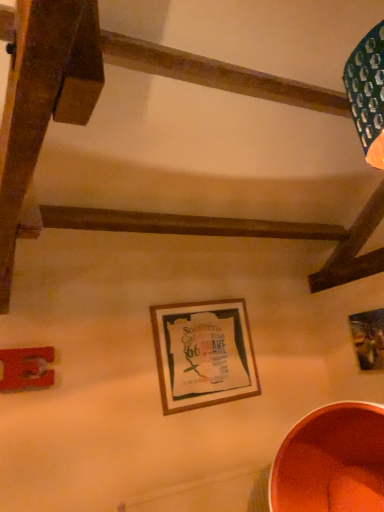
Image resolution: width=384 pixels, height=512 pixels. What do you see at coordinates (368, 339) in the screenshot? I see `wooden picture frame at upper right, placed as the 1th picture frame when sorted from right to left` at bounding box center [368, 339].

Identify the location of wooden picture frame at center, which is the 2th picture frame from left to right. (203, 354).

Where is `metallic silver picture frame at lower left, which ranks as the 1th picture frame in left-to-right order`? metallic silver picture frame at lower left, which ranks as the 1th picture frame in left-to-right order is located at coordinates (26, 369).

This screenshot has width=384, height=512. In order to click on picture frame that is the 2nd one when counting forward from the wooden picture frame at upper right, which ranks as the third picture frame in left-to-right order in this screenshot , I will do `click(26, 369)`.

Is wooden picture frame at upper right, which ranks as the third picture frame in left-to-right order, positioned far away from metallic silver picture frame at lower left, which ranks as the 1th picture frame in left-to-right order?

Yes, wooden picture frame at upper right, which ranks as the third picture frame in left-to-right order, and metallic silver picture frame at lower left, which ranks as the 1th picture frame in left-to-right order, are located far from each other.

Which of these two, wooden picture frame at upper right, placed as the 1th picture frame when sorted from right to left, or metallic silver picture frame at lower left, which ranks as the 1th picture frame in left-to-right order, is wider?

wooden picture frame at upper right, placed as the 1th picture frame when sorted from right to left, is wider.

From the image's perspective, who appears lower, wooden picture frame at center, which is the 2th picture frame from left to right, or metallic silver picture frame at lower left, which ranks as the 1th picture frame in left-to-right order?

wooden picture frame at center, which is the 2th picture frame from left to right, appears lower in the image.

Is wooden picture frame at center, which is the 2th picture frame from left to right, inside or outside of metallic silver picture frame at lower left, which is the third picture frame in right-to-left order?

wooden picture frame at center, which is the 2th picture frame from left to right, is located beyond the bounds of metallic silver picture frame at lower left, which is the third picture frame in right-to-left order.

This screenshot has height=512, width=384. In order to click on picture frame that is below the metallic silver picture frame at lower left, which ranks as the 1th picture frame in left-to-right order (from the image's perspective) in this screenshot , I will do `click(203, 354)`.

From the picture: Are wooden picture frame at center, which appears as the second picture frame when viewed from the right, and metallic silver picture frame at lower left, which is the third picture frame in right-to-left order, beside each other?

No, wooden picture frame at center, which appears as the second picture frame when viewed from the right, is not with metallic silver picture frame at lower left, which is the third picture frame in right-to-left order.

Looking at their sizes, would you say metallic silver picture frame at lower left, which ranks as the 1th picture frame in left-to-right order, is wider or thinner than metallic copper basin at lower right?

metallic silver picture frame at lower left, which ranks as the 1th picture frame in left-to-right order, is thinner than metallic copper basin at lower right.

Is metallic silver picture frame at lower left, which ranks as the 1th picture frame in left-to-right order, in contact with metallic copper basin at lower right?

No, metallic silver picture frame at lower left, which ranks as the 1th picture frame in left-to-right order, is not in contact with metallic copper basin at lower right.

Is metallic copper basin at lower right inside metallic silver picture frame at lower left, which is the third picture frame in right-to-left order?

No, metallic copper basin at lower right is not a part of metallic silver picture frame at lower left, which is the third picture frame in right-to-left order.

From the picture: From the image's perspective, who appears lower, metallic copper basin at lower right or wooden picture frame at center, which appears as the second picture frame when viewed from the right?

metallic copper basin at lower right is shown below in the image.

Which is behind, metallic copper basin at lower right or wooden picture frame at center, which appears as the second picture frame when viewed from the right?

wooden picture frame at center, which appears as the second picture frame when viewed from the right, is behind.

Is metallic copper basin at lower right not close to wooden picture frame at center, which appears as the second picture frame when viewed from the right?

No, there isn't a large distance between metallic copper basin at lower right and wooden picture frame at center, which appears as the second picture frame when viewed from the right.

Is wooden picture frame at center, which appears as the second picture frame when viewed from the right, located within metallic copper basin at lower right?

No, wooden picture frame at center, which appears as the second picture frame when viewed from the right, is located outside of metallic copper basin at lower right.

Is metallic silver picture frame at lower left, which ranks as the 1th picture frame in left-to-right order, closer to the viewer compared to wooden picture frame at center, which appears as the second picture frame when viewed from the right?

Yes, the depth of metallic silver picture frame at lower left, which ranks as the 1th picture frame in left-to-right order, is less than that of wooden picture frame at center, which appears as the second picture frame when viewed from the right.

How many degrees apart are the facing directions of metallic silver picture frame at lower left, which is the third picture frame in right-to-left order, and wooden picture frame at center, which appears as the second picture frame when viewed from the right?

There is a 1.56-degree angle between the facing directions of metallic silver picture frame at lower left, which is the third picture frame in right-to-left order, and wooden picture frame at center, which appears as the second picture frame when viewed from the right.

In the scene shown: From the image's perspective, between metallic silver picture frame at lower left, which ranks as the 1th picture frame in left-to-right order, and wooden picture frame at center, which is the 2th picture frame from left to right, which one is located above?

metallic silver picture frame at lower left, which ranks as the 1th picture frame in left-to-right order, is shown above in the image.

Is metallic silver picture frame at lower left, which ranks as the 1th picture frame in left-to-right order, facing away from wooden picture frame at center, which appears as the second picture frame when viewed from the right?

No, metallic silver picture frame at lower left, which ranks as the 1th picture frame in left-to-right order,'s orientation is not away from wooden picture frame at center, which appears as the second picture frame when viewed from the right.

Is the surface of metallic silver picture frame at lower left, which ranks as the 1th picture frame in left-to-right order, in direct contact with wooden picture frame at upper right, which ranks as the third picture frame in left-to-right order?

No, metallic silver picture frame at lower left, which ranks as the 1th picture frame in left-to-right order, is not next to wooden picture frame at upper right, which ranks as the third picture frame in left-to-right order.

Can we say metallic silver picture frame at lower left, which is the third picture frame in right-to-left order, lies outside wooden picture frame at upper right, which ranks as the third picture frame in left-to-right order?

Yes.

How different are the orientations of metallic silver picture frame at lower left, which ranks as the 1th picture frame in left-to-right order, and wooden picture frame at upper right, placed as the 1th picture frame when sorted from right to left, in degrees?

88.4 degrees.

Does metallic silver picture frame at lower left, which is the third picture frame in right-to-left order, come in front of wooden picture frame at upper right, which ranks as the third picture frame in left-to-right order?

Yes, the depth of metallic silver picture frame at lower left, which is the third picture frame in right-to-left order, is less than that of wooden picture frame at upper right, which ranks as the third picture frame in left-to-right order.

From a real-world perspective, which is physically above, metallic copper basin at lower right or wooden picture frame at upper right, placed as the 1th picture frame when sorted from right to left?

wooden picture frame at upper right, placed as the 1th picture frame when sorted from right to left, from a real-world perspective.

Measure the distance between metallic copper basin at lower right and wooden picture frame at upper right, placed as the 1th picture frame when sorted from right to left.

A distance of 28.76 inches exists between metallic copper basin at lower right and wooden picture frame at upper right, placed as the 1th picture frame when sorted from right to left.

Is metallic copper basin at lower right outside of wooden picture frame at upper right, which ranks as the third picture frame in left-to-right order?

Indeed, metallic copper basin at lower right is completely outside wooden picture frame at upper right, which ranks as the third picture frame in left-to-right order.

This screenshot has width=384, height=512. I want to click on basin that is in front of the wooden picture frame at upper right, which ranks as the third picture frame in left-to-right order, so click(x=331, y=462).

There is a wooden picture frame at upper right, which ranks as the third picture frame in left-to-right order. At what (x,y) coordinates should I click in order to perform the action: click on the 2nd picture frame above it (from a real-world perspective). Please return your answer as a coordinate pair (x, y). This screenshot has width=384, height=512. Looking at the image, I should click on (26, 369).

Find the location of a particular element. This screenshot has width=384, height=512. the 1st picture frame behind when counting from the metallic silver picture frame at lower left, which is the third picture frame in right-to-left order is located at coordinates (203, 354).

Considering their positions, is metallic silver picture frame at lower left, which ranks as the 1th picture frame in left-to-right order, positioned further to wooden picture frame at center, which appears as the second picture frame when viewed from the right, than metallic copper basin at lower right?

metallic silver picture frame at lower left, which ranks as the 1th picture frame in left-to-right order.

Based on their spatial positions, is metallic copper basin at lower right or metallic silver picture frame at lower left, which is the third picture frame in right-to-left order, further from wooden picture frame at center, which is the 2th picture frame from left to right?

The object further to wooden picture frame at center, which is the 2th picture frame from left to right, is metallic silver picture frame at lower left, which is the third picture frame in right-to-left order.

When comparing their distances from wooden picture frame at center, which appears as the second picture frame when viewed from the right, does metallic copper basin at lower right or wooden picture frame at upper right, placed as the 1th picture frame when sorted from right to left, seem further?

wooden picture frame at upper right, placed as the 1th picture frame when sorted from right to left, lies further to wooden picture frame at center, which appears as the second picture frame when viewed from the right, than the other object.

Considering their positions, is wooden picture frame at upper right, which ranks as the third picture frame in left-to-right order, positioned closer to metallic silver picture frame at lower left, which ranks as the 1th picture frame in left-to-right order, than wooden picture frame at center, which is the 2th picture frame from left to right?

Based on the image, wooden picture frame at center, which is the 2th picture frame from left to right, appears to be nearer to metallic silver picture frame at lower left, which ranks as the 1th picture frame in left-to-right order.

Which object lies nearer to the anchor point metallic copper basin at lower right, wooden picture frame at upper right, which ranks as the third picture frame in left-to-right order, or wooden picture frame at center, which appears as the second picture frame when viewed from the right?

wooden picture frame at upper right, which ranks as the third picture frame in left-to-right order, is closer to metallic copper basin at lower right.

Which object lies further to the anchor point metallic copper basin at lower right, metallic silver picture frame at lower left, which ranks as the 1th picture frame in left-to-right order, or wooden picture frame at center, which appears as the second picture frame when viewed from the right?

The object further to metallic copper basin at lower right is metallic silver picture frame at lower left, which ranks as the 1th picture frame in left-to-right order.

Based on their spatial positions, is wooden picture frame at center, which appears as the second picture frame when viewed from the right, or metallic silver picture frame at lower left, which is the third picture frame in right-to-left order, further from wooden picture frame at upper right, placed as the 1th picture frame when sorted from right to left?

Based on the image, metallic silver picture frame at lower left, which is the third picture frame in right-to-left order, appears to be further to wooden picture frame at upper right, placed as the 1th picture frame when sorted from right to left.

From the image, which object appears to be nearer to wooden picture frame at upper right, placed as the 1th picture frame when sorted from right to left, metallic copper basin at lower right or metallic silver picture frame at lower left, which is the third picture frame in right-to-left order?

metallic copper basin at lower right is positioned closer to the anchor wooden picture frame at upper right, placed as the 1th picture frame when sorted from right to left.

This screenshot has height=512, width=384. Find the location of `basin located between metallic silver picture frame at lower left, which is the third picture frame in right-to-left order, and wooden picture frame at upper right, which ranks as the third picture frame in left-to-right order, in the left-right direction`. basin located between metallic silver picture frame at lower left, which is the third picture frame in right-to-left order, and wooden picture frame at upper right, which ranks as the third picture frame in left-to-right order, in the left-right direction is located at coordinates (331, 462).

Locate an element on the screen. This screenshot has width=384, height=512. picture frame between metallic silver picture frame at lower left, which is the third picture frame in right-to-left order, and metallic copper basin at lower right, in the horizontal direction is located at coordinates (203, 354).

The image size is (384, 512). I want to click on basin between wooden picture frame at center, which is the 2th picture frame from left to right, and wooden picture frame at upper right, which ranks as the third picture frame in left-to-right order, so click(331, 462).

Identify the location of picture frame between metallic silver picture frame at lower left, which ranks as the 1th picture frame in left-to-right order, and wooden picture frame at upper right, placed as the 1th picture frame when sorted from right to left. The image size is (384, 512). (203, 354).